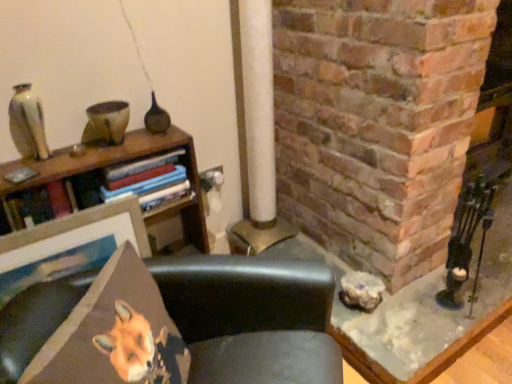
Describe the element at coordinates (176, 324) in the screenshot. This screenshot has height=384, width=512. I see `black leather chair at center` at that location.

Locate an element on the screen. orange fabric fox at lower left is located at coordinates (115, 333).

What's the angular difference between black leather chair at center and orange fabric fox at lower left's facing directions?

The angle between the facing direction of black leather chair at center and the facing direction of orange fabric fox at lower left is 0.00198 degrees.

From a real-world perspective, is black leather chair at center physically above orange fabric fox at lower left?

Actually, black leather chair at center is physically below orange fabric fox at lower left in the real world.

From the image's perspective, is black leather chair at center beneath orange fabric fox at lower left?

Indeed, from the image's perspective, black leather chair at center is shown beneath orange fabric fox at lower left.

Does black leather chair at center have a greater height compared to orange fabric fox at lower left?

Yes.

Is orange fabric fox at lower left inside matte white vase at upper left?

No, orange fabric fox at lower left is not a part of matte white vase at upper left.

Consider the image. Are matte white vase at upper left and orange fabric fox at lower left located far from each other?

They are positioned close to each other.

This screenshot has height=384, width=512. I want to click on throw pillow below the matte white vase at upper left (from a real-world perspective), so click(115, 333).

Considering the relative sizes of orange fabric fox at lower left and matte white vase at upper left in the image provided, is orange fabric fox at lower left wider than matte white vase at upper left?

Yes.

Based on the photo, is orange fabric fox at lower left located outside matte white vase at upper left?

Yes, orange fabric fox at lower left is located beyond the bounds of matte white vase at upper left.

Which object is further away from the camera taking this photo, orange fabric fox at lower left or matte white vase at upper left?

matte white vase at upper left is behind.

Measure the distance between orange fabric fox at lower left and matte white vase at upper left.

They are 30.49 inches apart.

Based on the photo, is black leather chair at center at the back of matte white vase at upper left?

No.

Between matte white vase at upper left and black leather chair at center, which one has larger width?

With larger width is black leather chair at center.

From the image's perspective, which is below, matte white vase at upper left or black leather chair at center?

black leather chair at center.

From a real-world perspective, is matte white vase at upper left positioned above or below black leather chair at center?

matte white vase at upper left is situated higher than black leather chair at center in the real world.

Visually, is orange fabric fox at lower left positioned to the left or to the right of black leather chair at center?

Based on their positions, orange fabric fox at lower left is located to the left of black leather chair at center.

Does point (149, 340) come behind point (243, 348)?

No, (149, 340) is closer to viewer.

Considering their positions, is orange fabric fox at lower left located in front of or behind black leather chair at center?

orange fabric fox at lower left is behind black leather chair at center.

Is black leather chair at center further to camera compared to matte white vase at upper left?

No, it is not.

From the image's perspective, is black leather chair at center located above or below matte white vase at upper left?

black leather chair at center is situated lower than matte white vase at upper left in the image.

How many degrees apart are the facing directions of black leather chair at center and matte white vase at upper left?

They differ by 48.2 degrees in their facing directions.

Where is `throw pillow located behind the black leather chair at center`? throw pillow located behind the black leather chair at center is located at coordinates click(115, 333).

Locate an element on the screen. The image size is (512, 384). throw pillow that appears in front of the matte white vase at upper left is located at coordinates (115, 333).

When comparing their distances from black leather chair at center, does matte white vase at upper left or orange fabric fox at lower left seem closer?

orange fabric fox at lower left is closer to black leather chair at center.

Which object lies nearer to the anchor point matte white vase at upper left, orange fabric fox at lower left or black leather chair at center?

orange fabric fox at lower left is closer to matte white vase at upper left.

When comparing their distances from orange fabric fox at lower left, does black leather chair at center or matte white vase at upper left seem closer?

black leather chair at center.

Consider the image. Based on their spatial positions, is orange fabric fox at lower left or matte white vase at upper left further from black leather chair at center?

Based on the image, matte white vase at upper left appears to be further to black leather chair at center.

When comparing their distances from matte white vase at upper left, does black leather chair at center or orange fabric fox at lower left seem further?

Among the two, black leather chair at center is located further to matte white vase at upper left.

Considering their positions, is matte white vase at upper left positioned closer to orange fabric fox at lower left than black leather chair at center?

black leather chair at center lies closer to orange fabric fox at lower left than the other object.

This screenshot has height=384, width=512. Find the location of `throw pillow between matte white vase at upper left and black leather chair at center vertically`. throw pillow between matte white vase at upper left and black leather chair at center vertically is located at coordinates (115, 333).